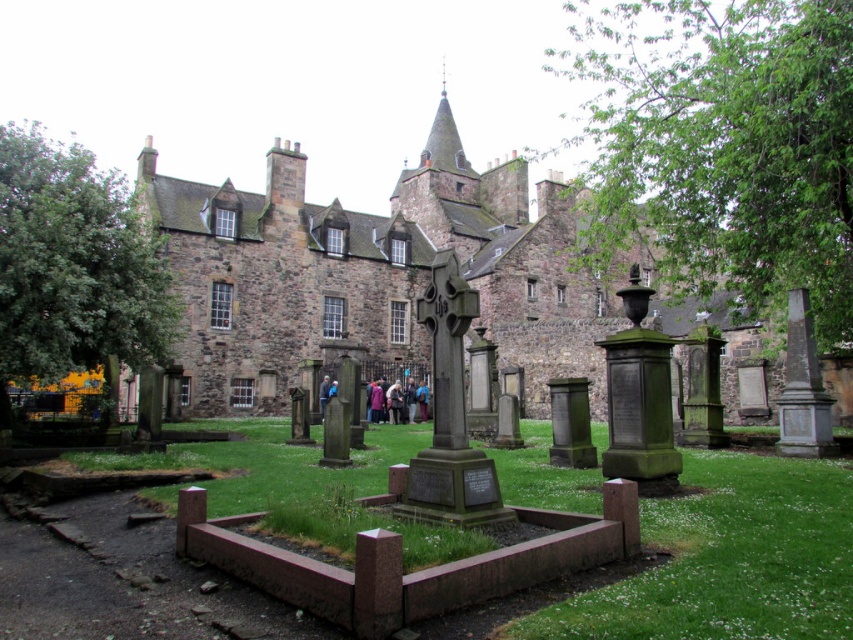
Question: Which of the following is the closest to the observer?

Choices:
 (A) (396, 412)
 (B) (323, 387)
 (C) (270, 170)

Answer: (B)

Question: Does brown stone castle at center appear under dark blue fabric at center?

Choices:
 (A) no
 (B) yes

Answer: (A)

Question: Does brown stone castle at center have a larger size compared to dark purple sweater at center?

Choices:
 (A) yes
 (B) no

Answer: (A)

Question: Considering the real-world distances, which object is farthest from the dark blue fabric at center?

Choices:
 (A) dark purple sweater at center
 (B) brown stone castle at center

Answer: (B)

Question: Which object is positioned farthest from the brown stone castle at center?

Choices:
 (A) dark blue fabric at center
 (B) dark purple sweater at center

Answer: (A)

Question: Can you confirm if brown stone castle at center is positioned above dark blue fabric at center?

Choices:
 (A) no
 (B) yes

Answer: (B)